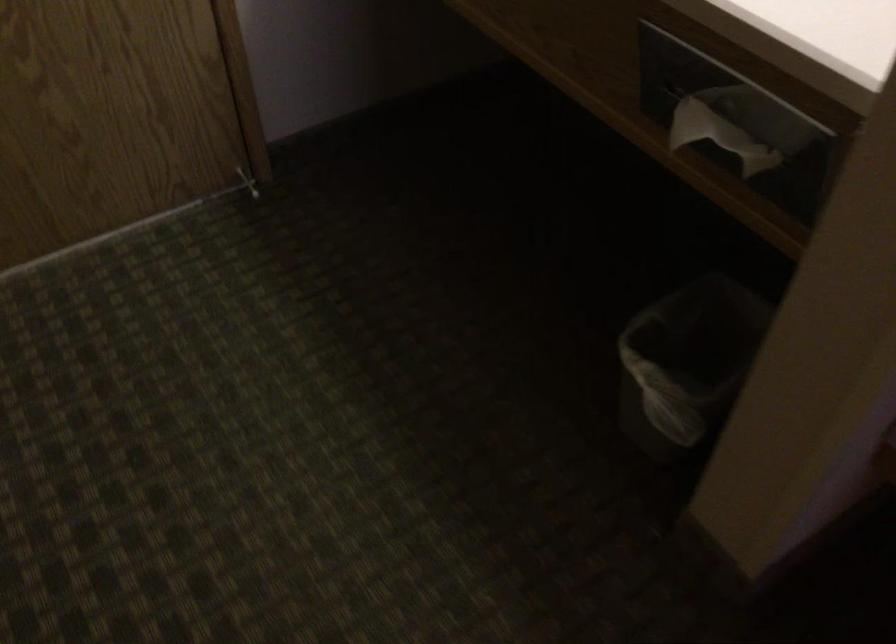
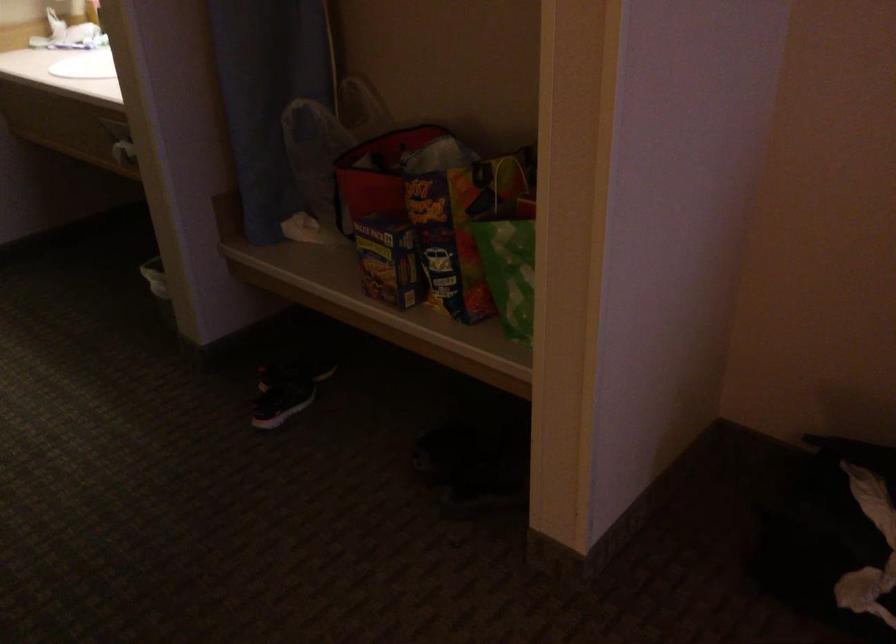
The images are taken continuously from a first-person perspective. In which direction are you moving?

The cameraman walked toward right, backward.